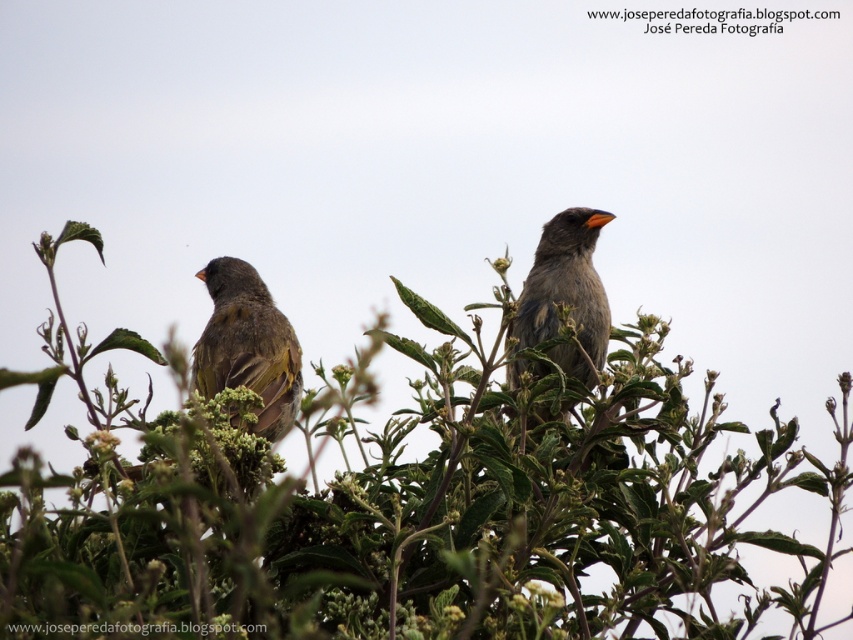
Question: In this image, where is greenish-brown feathers at left located relative to brown feathered bird at center?

Choices:
 (A) left
 (B) right

Answer: (A)

Question: Among these points, which one is farthest from the camera?

Choices:
 (A) (590, 227)
 (B) (256, 413)

Answer: (A)

Question: Can you confirm if greenish-brown feathers at left is positioned to the left of brown feathered bird at center?

Choices:
 (A) yes
 (B) no

Answer: (A)

Question: Which point appears farthest from the camera in this image?

Choices:
 (A) (268, 435)
 (B) (544, 372)

Answer: (B)

Question: Does greenish-brown feathers at left have a smaller size compared to brown feathered bird at center?

Choices:
 (A) no
 (B) yes

Answer: (A)